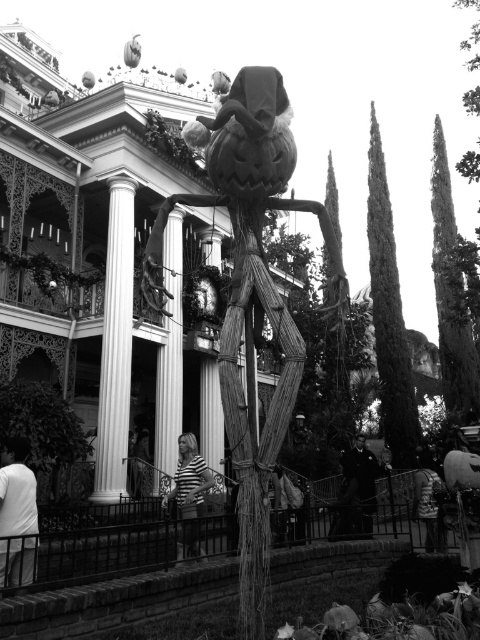
Question: Which point is farther to the camera?

Choices:
 (A) white fabric at lower left
 (B) smooth black suit at center
 (C) wooden pumpkin at center

Answer: (B)

Question: Is white fabric at lower left smaller than striped fabric person at center?

Choices:
 (A) no
 (B) yes

Answer: (B)

Question: Which object is farther from the camera taking this photo?

Choices:
 (A) wooden pumpkin at center
 (B) striped fabric person at center
 (C) smooth black suit at center

Answer: (C)

Question: Can you confirm if wooden pumpkin at center is smaller than striped fabric person at center?

Choices:
 (A) yes
 (B) no

Answer: (B)

Question: Which point appears farthest from the camera in this image?

Choices:
 (A) (253, 156)
 (B) (363, 452)
 (C) (31, 579)

Answer: (B)

Question: Does wooden pumpkin at center appear under smooth black suit at center?

Choices:
 (A) no
 (B) yes

Answer: (A)